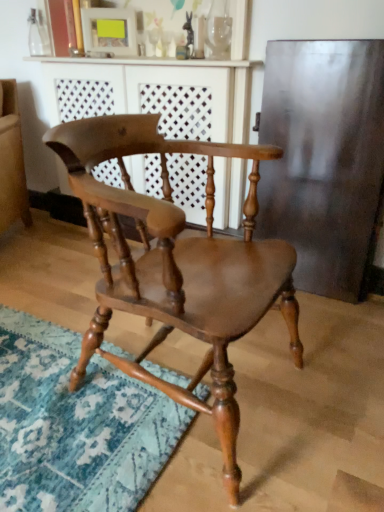
Looking at this image, measure the distance between point (134,216) and camera.

31.26 inches.

This screenshot has height=512, width=384. Identify the location of shiny brown wood chair at center. (177, 264).

What do you see at coordinates (177, 264) in the screenshot? Image resolution: width=384 pixels, height=512 pixels. I see `shiny brown wood chair at center` at bounding box center [177, 264].

What is the approximate width of wooden dresser at center?

wooden dresser at center is 14.64 inches wide.

The image size is (384, 512). In order to click on wooden dresser at center in this screenshot , I will do `click(155, 94)`.

What do you see at coordinates (155, 94) in the screenshot? I see `wooden dresser at center` at bounding box center [155, 94].

Identify the location of shiny brown wood chair at center. (177, 264).

Is wooden dresser at center to the left of shiny brown wood chair at center from the viewer's perspective?

Indeed, wooden dresser at center is positioned on the left side of shiny brown wood chair at center.

Considering the positions of objects wooden dresser at center and shiny brown wood chair at center in the image provided, who is behind, wooden dresser at center or shiny brown wood chair at center?

wooden dresser at center is further away from the camera.

Which is further, (x=202, y=96) or (x=71, y=159)?

The point (x=202, y=96) is more distant.

From the image's perspective, would you say wooden dresser at center is positioned over shiny brown wood chair at center?

Yes.

From a real-world perspective, is wooden dresser at center below shiny brown wood chair at center?

Incorrect, from a real-world perspective, wooden dresser at center is higher than shiny brown wood chair at center.

Which object is thinner, wooden dresser at center or shiny brown wood chair at center?

wooden dresser at center is thinner.

Considering the sizes of wooden dresser at center and shiny brown wood chair at center in the image, is wooden dresser at center taller or shorter than shiny brown wood chair at center?

Considering their sizes, wooden dresser at center has more height than shiny brown wood chair at center.

Can you confirm if wooden dresser at center is smaller than shiny brown wood chair at center?

Actually, wooden dresser at center might be larger than shiny brown wood chair at center.

Would you say wooden dresser at center is inside or outside shiny brown wood chair at center?

wooden dresser at center is not inside shiny brown wood chair at center, it's outside.

Are wooden dresser at center and shiny brown wood chair at center located far from each other?

Actually, wooden dresser at center and shiny brown wood chair at center are a little close together.

Does wooden dresser at center turn towards shiny brown wood chair at center?

Yes, wooden dresser at center is turned towards shiny brown wood chair at center.

What's the angular difference between wooden dresser at center and shiny brown wood chair at center's facing directions?

There is a 89.8-degree angle between the facing directions of wooden dresser at center and shiny brown wood chair at center.

The image size is (384, 512). Identify the location of chair in front of the wooden dresser at center. (177, 264).

Between shiny brown wood chair at center and wooden dresser at center, which one appears on the left side from the viewer's perspective?

Positioned to the left is wooden dresser at center.

Is shiny brown wood chair at center closer to camera compared to wooden dresser at center?

Yes, shiny brown wood chair at center is closer to the camera.

Does point (153, 290) come closer to viewer compared to point (98, 106)?

Yes, point (153, 290) is closer to viewer.

From the image's perspective, between shiny brown wood chair at center and wooden dresser at center, which one is located above?

wooden dresser at center appears higher in the image.

From a real-world perspective, between shiny brown wood chair at center and wooden dresser at center, who is vertically lower?

From a 3D spatial view, shiny brown wood chair at center is below.

Between shiny brown wood chair at center and wooden dresser at center, which one has smaller width?

wooden dresser at center is thinner.

Is shiny brown wood chair at center taller or shorter than wooden dresser at center?

In the image, shiny brown wood chair at center appears to be shorter than wooden dresser at center.

Consider the image. Considering the sizes of objects shiny brown wood chair at center and wooden dresser at center in the image provided, who is smaller, shiny brown wood chair at center or wooden dresser at center?

shiny brown wood chair at center.

Could wooden dresser at center be considered to be inside shiny brown wood chair at center?

No, wooden dresser at center is not a part of shiny brown wood chair at center.

Would you consider shiny brown wood chair at center to be distant from wooden dresser at center?

Actually, shiny brown wood chair at center and wooden dresser at center are a little close together.

Is shiny brown wood chair at center oriented towards wooden dresser at center?

No, shiny brown wood chair at center does not turn towards wooden dresser at center.

From the picture: How many degrees apart are the facing directions of shiny brown wood chair at center and wooden dresser at center?

The angle between the facing direction of shiny brown wood chair at center and the facing direction of wooden dresser at center is 89.8 degrees.

How distant is shiny brown wood chair at center from wooden dresser at center?

A distance of 74.26 centimeters exists between shiny brown wood chair at center and wooden dresser at center.

I want to click on dresser that appears on the left of shiny brown wood chair at center, so click(155, 94).

Identify the location of dresser on the left of shiny brown wood chair at center. The height and width of the screenshot is (512, 384). (155, 94).

Find the location of a particular element. This screenshot has width=384, height=512. chair that appears below the wooden dresser at center (from the image's perspective) is located at coordinates (177, 264).